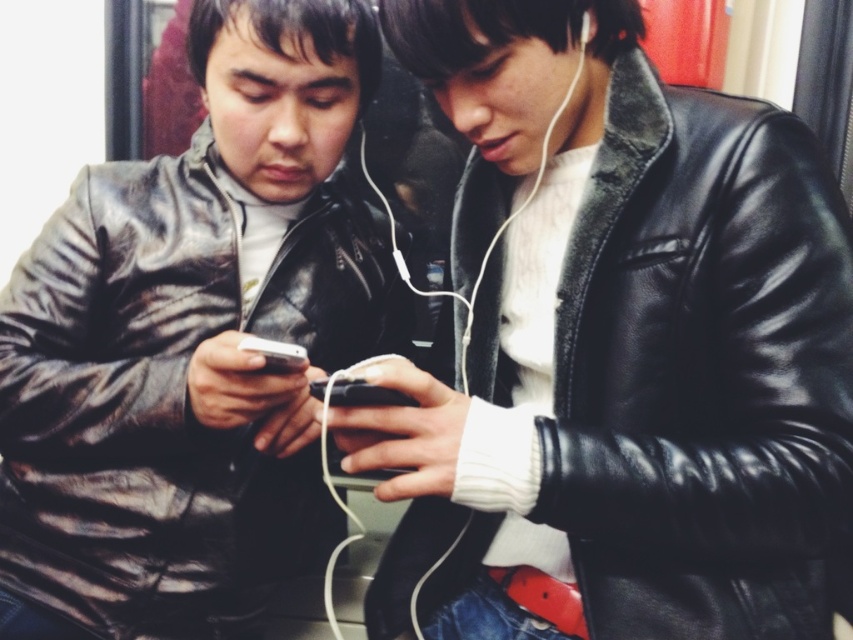
Locate an element on the screen. The height and width of the screenshot is (640, 853). matte black jacket at center is located at coordinates (189, 342).

Is the position of matte black jacket at center less distant than that of black leather jacket at center?

No, matte black jacket at center is behind black leather jacket at center.

Where is `matte black jacket at center`? Image resolution: width=853 pixels, height=640 pixels. matte black jacket at center is located at coordinates (189, 342).